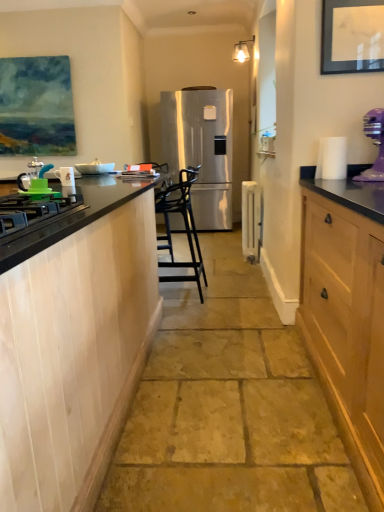
Measure the distance between point (93, 164) and camera.

Point (93, 164) and camera are 5.25 meters apart from each other.

This screenshot has width=384, height=512. I want to click on matte black picture frame at upper right, so click(x=352, y=36).

What do you see at coordinates (352, 36) in the screenshot? The image size is (384, 512). I see `matte black picture frame at upper right` at bounding box center [352, 36].

Describe the element at coordinates (33, 213) in the screenshot. The width and height of the screenshot is (384, 512). I see `black matte gas stove at left` at that location.

What do you see at coordinates (36, 182) in the screenshot? I see `green matte kettle at left, which ranks as the 4th appliance in back-to-front order` at bounding box center [36, 182].

You are a GUI agent. You are given a task and a screenshot of the screen. Output one action in this format:
    pyautogui.click(x=<x>, y=<y>)
    Task: Click on the black metal bar stool at center
    The height and width of the screenshot is (512, 384).
    Given the screenshot: What is the action you would take?
    pyautogui.click(x=184, y=222)

The width and height of the screenshot is (384, 512). Find the location of `white glossy bowl at center, which appears as the first appliance when viewed from the left`. white glossy bowl at center, which appears as the first appliance when viewed from the left is located at coordinates click(95, 168).

Would you consider white metallic radiator at center, the first appliance from the back, to be distant from black matte gas stove at left?

Yes, white metallic radiator at center, the first appliance from the back, and black matte gas stove at left are quite far apart.

How different are the orientations of white metallic radiator at center, the first appliance from the back, and black matte gas stove at left in degrees?

They differ by 1.29 degrees in their facing directions.

Is white metallic radiator at center, which is the fourth appliance in left-to-right order, wider or thinner than black matte gas stove at left?

white metallic radiator at center, which is the fourth appliance in left-to-right order, is thinner than black matte gas stove at left.

Can you confirm if white metallic radiator at center, placed as the 4th appliance when sorted from front to back, is shorter than black matte gas stove at left?

No.

From the image's perspective, is satin silver refrigerator at center on matte black picture frame at upper right?

Yes, from the image's perspective, satin silver refrigerator at center is on top of matte black picture frame at upper right.

Does satin silver refrigerator at center come in front of matte black picture frame at upper right?

No, satin silver refrigerator at center is further to the viewer.

Does satin silver refrigerator at center touch matte black picture frame at upper right?

No, satin silver refrigerator at center is not in contact with matte black picture frame at upper right.

Based on their positions, is matte black picture frame at upper right located to the left or right of black metal bar stool at center?

matte black picture frame at upper right is positioned on black metal bar stool at center's right side.

Can we say matte black picture frame at upper right lies outside black metal bar stool at center?

Absolutely, matte black picture frame at upper right is external to black metal bar stool at center.

I want to click on picture frame located above the black metal bar stool at center (from the image's perspective), so click(x=352, y=36).

From a real-world perspective, between white glossy mug at left, placed as the second appliance when sorted from front to back, and green matte kettle at left, acting as the 2th appliance starting from the right, who is vertically higher?

green matte kettle at left, acting as the 2th appliance starting from the right.

Locate an element on the screen. the 2nd appliance directly beneath the green matte kettle at left, acting as the 2th appliance starting from the right (from a real-world perspective) is located at coordinates (66, 176).

Is white glossy mug at left, placed as the second appliance when sorted from front to back, far from green matte kettle at left, the first appliance from the front?

Absolutely, white glossy mug at left, placed as the second appliance when sorted from front to back, is distant from green matte kettle at left, the first appliance from the front.

Does point (67, 172) lie in front of point (42, 166)?

Yes, it is.

How much distance is there between white glossy mug at left, the second appliance viewed from the left, and matte black picture frame at upper right?

1.62 meters.

Is white glossy mug at left, the second appliance viewed from the left, bigger or smaller than matte black picture frame at upper right?

white glossy mug at left, the second appliance viewed from the left, is smaller than matte black picture frame at upper right.

From a real-world perspective, is white glossy mug at left, marked as the 3th appliance in a right-to-left arrangement, physically located above or below matte black picture frame at upper right?

From a real-world perspective, white glossy mug at left, marked as the 3th appliance in a right-to-left arrangement, is physically below matte black picture frame at upper right.

Does white glossy mug at left, which appears as the third appliance when viewed from the back, have a lesser height compared to matte black picture frame at upper right?

Indeed, white glossy mug at left, which appears as the third appliance when viewed from the back, has a lesser height compared to matte black picture frame at upper right.

From a real-world perspective, which is physically above, matte black picture frame at upper right or white glossy bowl at center, the fourth appliance when ordered from right to left?

matte black picture frame at upper right.

Considering their positions, is matte black picture frame at upper right located in front of or behind white glossy bowl at center, which appears as the 3th appliance when viewed from the front?

matte black picture frame at upper right is in front of white glossy bowl at center, which appears as the 3th appliance when viewed from the front.

From the image's perspective, between matte black picture frame at upper right and white glossy bowl at center, which appears as the first appliance when viewed from the left, who is located below?

white glossy bowl at center, which appears as the first appliance when viewed from the left, from the image's perspective.

From a real-world perspective, is purple plastic mixer at right physically below satin silver refrigerator at center?

No, from a real-world perspective, purple plastic mixer at right is not beneath satin silver refrigerator at center.

Does purple plastic mixer at right lie behind satin silver refrigerator at center?

No, it is in front of satin silver refrigerator at center.

The image size is (384, 512). In order to click on refrigerator lying on the left of purple plastic mixer at right in this screenshot , I will do `click(201, 149)`.

Is purple plastic mixer at right aimed at satin silver refrigerator at center?

No, purple plastic mixer at right is not oriented towards satin silver refrigerator at center.

In the image, there is a black matte gas stove at left. Where is `appliance below it (from a real-world perspective)`? appliance below it (from a real-world perspective) is located at coordinates (251, 220).

Image resolution: width=384 pixels, height=512 pixels. I want to click on refrigerator that appears behind the matte black picture frame at upper right, so click(x=201, y=149).

Estimate the real-world distances between objects in this image. Which object is further from white glossy bowl at center, which appears as the 3th appliance when viewed from the front, satin silver refrigerator at center or purple plastic mixer at right?

The object further to white glossy bowl at center, which appears as the 3th appliance when viewed from the front, is satin silver refrigerator at center.

Based on their spatial positions, is black matte gas stove at left or green matte kettle at left, which ranks as the 4th appliance in back-to-front order, further from white glossy mug at left, marked as the 3th appliance in a right-to-left arrangement?

green matte kettle at left, which ranks as the 4th appliance in back-to-front order, is further to white glossy mug at left, marked as the 3th appliance in a right-to-left arrangement.

Estimate the real-world distances between objects in this image. Which object is further from matte black picture frame at upper right, satin silver refrigerator at center or white glossy bowl at center, the fourth appliance when ordered from right to left?

satin silver refrigerator at center.

Estimate the real-world distances between objects in this image. Which object is closer to green matte kettle at left, acting as the 2th appliance starting from the right, black matte gas stove at left or purple plastic mixer at right?

The object closer to green matte kettle at left, acting as the 2th appliance starting from the right, is black matte gas stove at left.

Based on the photo, estimate the real-world distances between objects in this image. Which object is further from white glossy mug at left, marked as the 3th appliance in a right-to-left arrangement, black metal bar stool at center or green matte kettle at left, acting as the 2th appliance starting from the right?

black metal bar stool at center is further to white glossy mug at left, marked as the 3th appliance in a right-to-left arrangement.

Based on their spatial positions, is white glossy bowl at center, the fourth appliance when ordered from right to left, or purple plastic mixer at right further from black matte gas stove at left?

white glossy bowl at center, the fourth appliance when ordered from right to left.

When comparing their distances from matte black picture frame at upper right, does black matte gas stove at left or satin silver refrigerator at center seem further?

The object further to matte black picture frame at upper right is satin silver refrigerator at center.

Based on their spatial positions, is matte black picture frame at upper right or black metal bar stool at center closer to white glossy mug at left, placed as the second appliance when sorted from front to back?

matte black picture frame at upper right is positioned closer to the anchor white glossy mug at left, placed as the second appliance when sorted from front to back.

Find the location of a particular element. chair between green matte kettle at left, acting as the 2th appliance starting from the right, and purple plastic mixer at right from left to right is located at coordinates (184, 222).

At what (x,y) coordinates should I click in order to perform the action: click on appliance located between green matte kettle at left, which ranks as the 4th appliance in back-to-front order, and black metal bar stool at center in the depth direction. Please return your answer as a coordinate pair (x, y). Image resolution: width=384 pixels, height=512 pixels. Looking at the image, I should click on coord(66,176).

At what (x,y) coordinates should I click in order to perform the action: click on chair between white glossy bowl at center, which appears as the 3th appliance when viewed from the front, and white metallic radiator at center, the first appliance from the back. Please return your answer as a coordinate pair (x, y). Looking at the image, I should click on (184, 222).

I want to click on chair between white glossy mug at left, placed as the second appliance when sorted from front to back, and matte black picture frame at upper right, so click(184, 222).